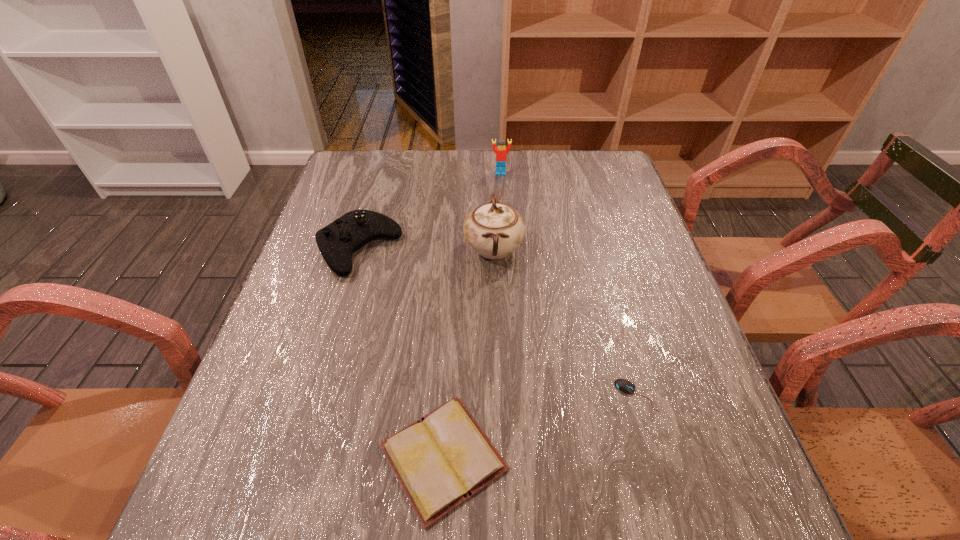
Image resolution: width=960 pixels, height=540 pixels. What are the coordinates of `vacant space located on the right of the third shortest object` in the screenshot? It's located at (488, 249).

You are a GUI agent. You are given a task and a screenshot of the screen. Output one action in this format:
    pyautogui.click(x=<x>, y=<y>)
    Task: Click on the vacant space located on the right of the diary
    
    Given the screenshot: What is the action you would take?
    pyautogui.click(x=658, y=457)

You are a GUI agent. You are given a task and a screenshot of the screen. Output one action in this format:
    pyautogui.click(x=<x>, y=<y>)
    Task: Click on the vacant space situated 0.100m on the right of the shortest object
    The width and height of the screenshot is (960, 540).
    Given the screenshot: What is the action you would take?
    pyautogui.click(x=708, y=395)

This screenshot has width=960, height=540. In order to click on object at the far edge in this screenshot , I will do `click(501, 157)`.

Locate an element on the screen. object that is positioned at the near edge is located at coordinates (443, 459).

This screenshot has width=960, height=540. In order to click on object located at the left edge in this screenshot , I will do `click(337, 242)`.

Locate an element on the screen. The height and width of the screenshot is (540, 960). object that is at the right edge is located at coordinates (624, 385).

Where is `vacant region at the far edge of the desktop`? vacant region at the far edge of the desktop is located at coordinates (x=526, y=160).

Locate an element on the screen. The height and width of the screenshot is (540, 960). free space at the near edge of the desktop is located at coordinates (515, 521).

In the image, there is a desktop. At what (x,y) coordinates should I click in order to perform the action: click on vacant space at the left edge. Please return your answer as a coordinate pair (x, y). The height and width of the screenshot is (540, 960). Looking at the image, I should click on (331, 203).